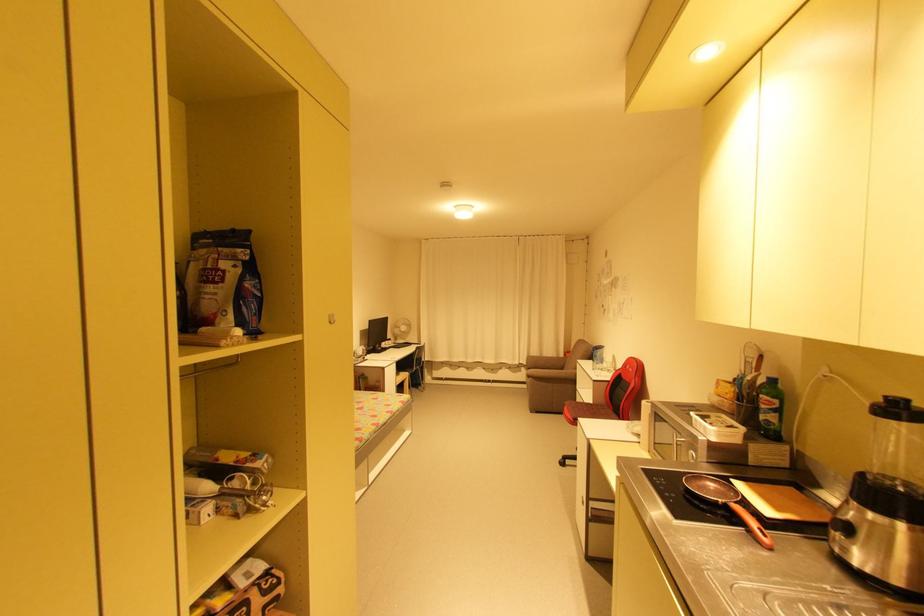
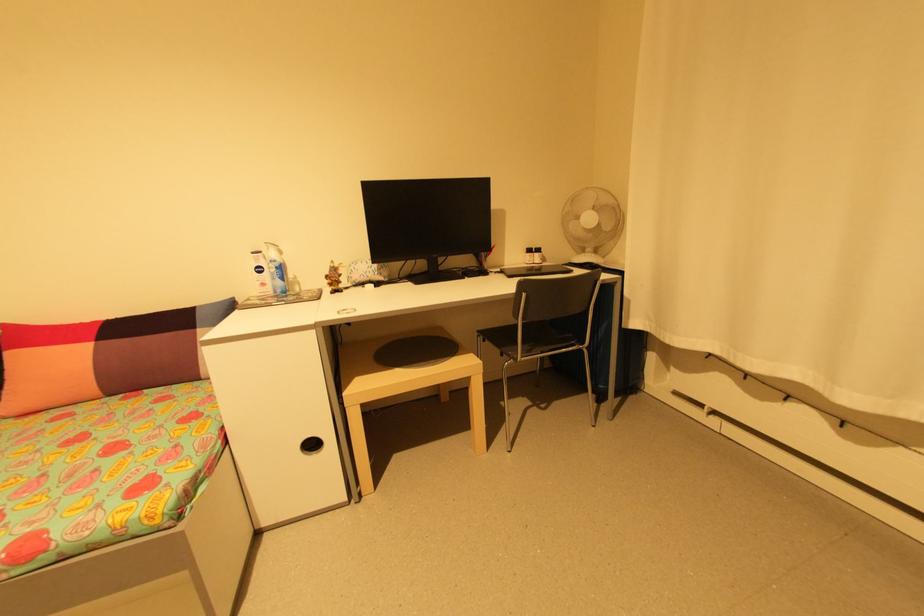
Question: I am providing you with two images of the same scene from different viewpoints. Which of the following objects are not visible in image2?

Choices:
 (A) sofa sitting surface
 (B) chair sitting surface
 (C) stool sitting surface
 (D) none of these

Answer: (D)